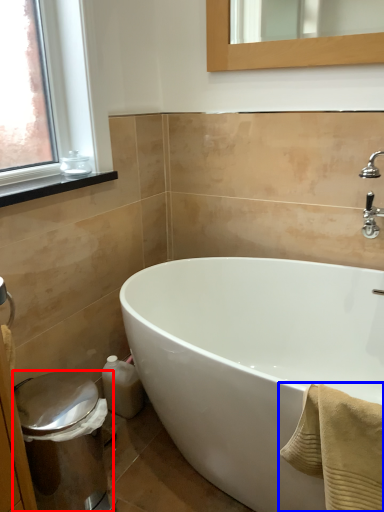
Question: Which object is closer to the camera taking this photo, bidet (highlighted by a red box) or bath towel (highlighted by a blue box)?

Choices:
 (A) bidet
 (B) bath towel

Answer: (B)